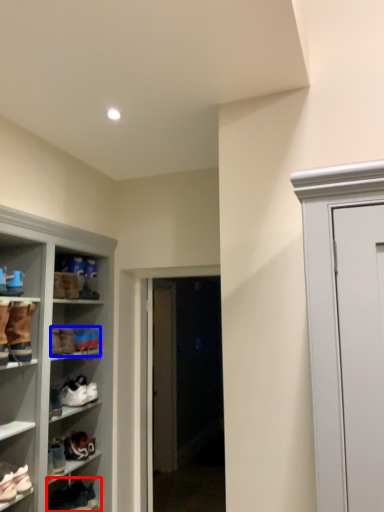
Question: Which point is closer to the camera, footwear (highlighted by a red box) or footwear (highlighted by a blue box)?

Choices:
 (A) footwear
 (B) footwear

Answer: (A)